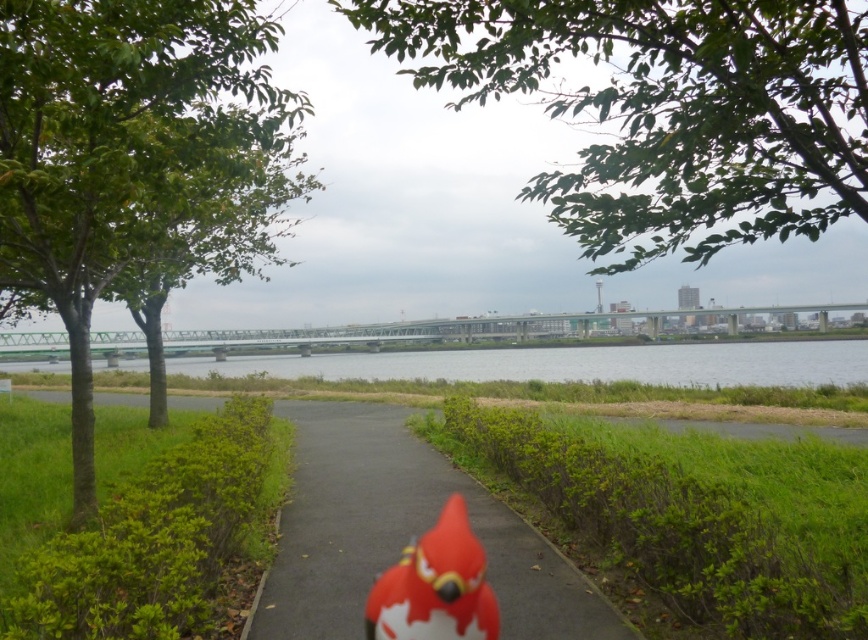
Consider the image. You are a hiker planning to cross the bridge in the midground. You notice the green leafy tree at left and the clear water at center. Which object would block your view of the other when standing on the bridge?

The green leafy tree at left is bigger than the clear water at center, so when standing on the bridge, the green leafy tree at left would block your view of the clear water at center.

You are standing at the center of the bridge spanning the river. Which direction should you walk to reach the green leafy tree at left?

The green leafy tree at left is located at point (117, 147), which is to the left side of the scene. Therefore, you should walk to the left from the bridge to reach it.

You are a hiker who wants to cross the river but needs to know which is longer between the smooth asphalt path at center and the clear water at center. Which one is longer?

The clear water at center is longer than the smooth asphalt path at center.